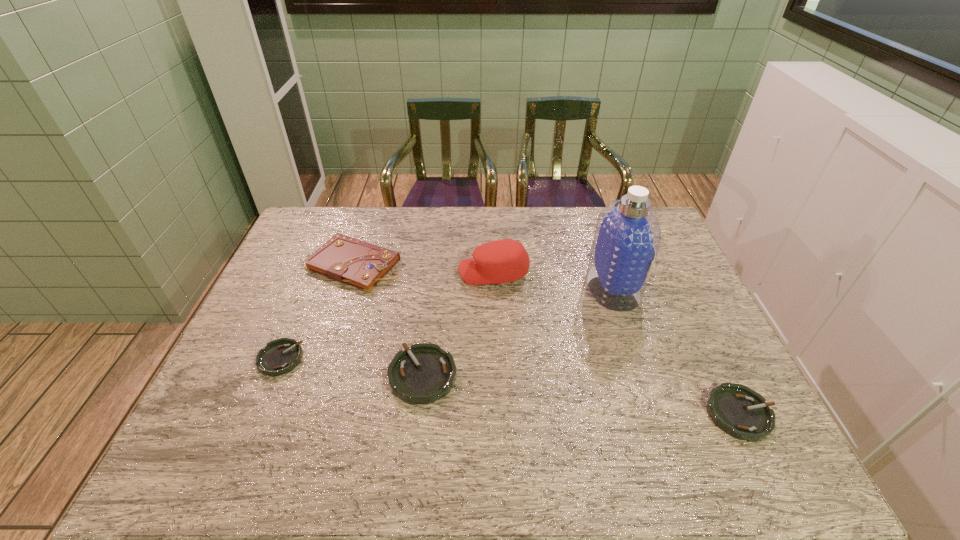
This screenshot has width=960, height=540. I want to click on free space between the rightmost object and the notebook, so click(x=547, y=339).

I want to click on vacant region between the cap and the cleansing agent, so click(x=553, y=280).

Locate an element on the screen. vacant space that is in between the cap and the notebook is located at coordinates (424, 268).

Where is `unoccupied position between the leftmost ashtray and the fifth shortest object`? This screenshot has width=960, height=540. unoccupied position between the leftmost ashtray and the fifth shortest object is located at coordinates (387, 315).

At what (x,y) coordinates should I click in order to perform the action: click on free space between the fifth object from left to right and the cap. Please return your answer as a coordinate pair (x, y). This screenshot has width=960, height=540. Looking at the image, I should click on (553, 280).

What are the coordinates of `vacant point located between the fourth shortest object and the shortest object` in the screenshot? It's located at (318, 312).

Identify the location of empty location between the cap and the shortest ashtray. (387, 315).

Identify the location of vacant point located between the second shortest ashtray and the shortest ashtray. (511, 386).

This screenshot has height=540, width=960. What are the coordinates of `vacant space that's between the fifth shortest object and the leftmost ashtray` in the screenshot? It's located at (387, 315).

You are a GUI agent. You are given a task and a screenshot of the screen. Output one action in this format:
    pyautogui.click(x=<x>, y=<y>)
    Task: Click on the free space between the tallest object and the fourth tallest object
    The image size is (960, 540).
    Given the screenshot: What is the action you would take?
    pyautogui.click(x=518, y=331)